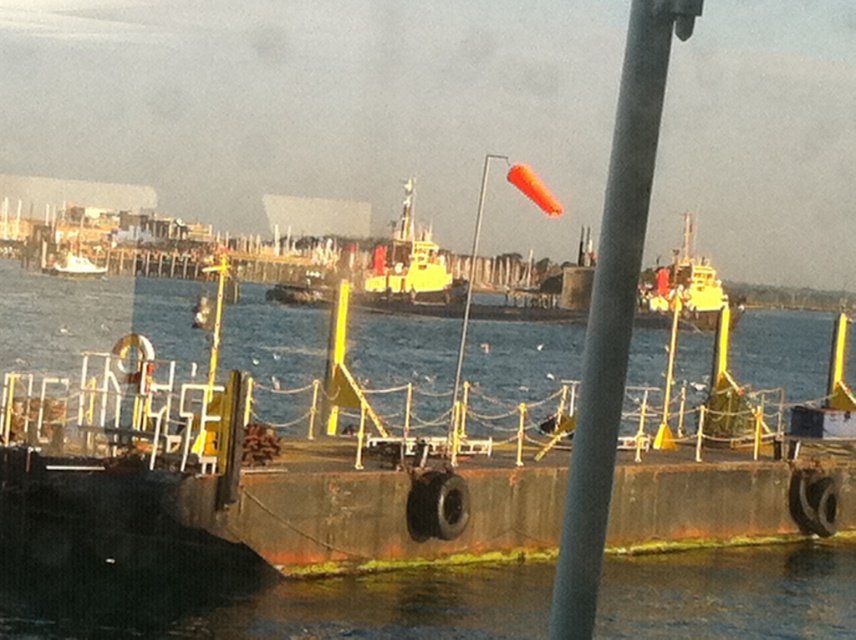
Question: Which point is closer to the camera taking this photo?

Choices:
 (A) (70, 275)
 (B) (75, 296)
 (C) (643, 186)

Answer: (C)

Question: Does metallic gray pole at center lie behind white matte boat at left?

Choices:
 (A) yes
 (B) no

Answer: (B)

Question: Among these objects, which one is farthest from the camera?

Choices:
 (A) white matte boat at left
 (B) metallic gray pole at center
 (C) blue water at center

Answer: (A)

Question: Can you confirm if blue water at center is positioned below white matte boat at left?

Choices:
 (A) no
 (B) yes

Answer: (B)

Question: Does blue water at center have a larger size compared to metallic gray pole at center?

Choices:
 (A) yes
 (B) no

Answer: (A)

Question: Which point appears farthest from the camera in this image?

Choices:
 (A) (74, 253)
 (B) (571, 541)
 (C) (450, 353)

Answer: (A)